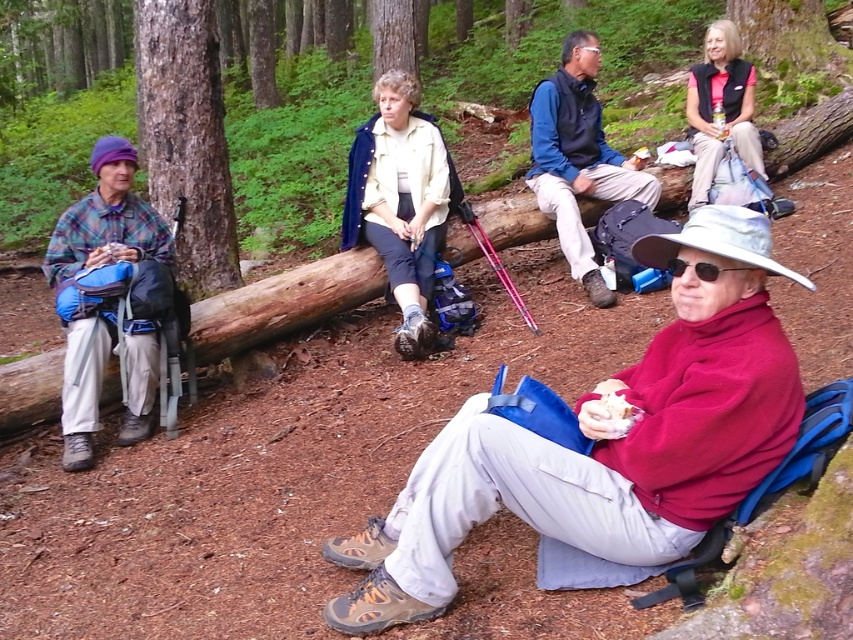
You are standing at the starting point and need to reach the black plastic sunglasses at lower center. There is a blue fabric backpack at center in your path. Can you walk around it without getting too close? Explain your reasoning.

The blue fabric backpack at center is 9.44 feet away from the black plastic sunglasses at lower center. Since the backpack is in your path, you can walk around it as there is enough space between them to maneuver around without getting too close.

You are a photographer trying to capture a photo of the plaid fabric shirt at left and the matte black vest at upper right. Which object should you focus on first if you want to ensure both are in the frame without moving the camera?

You should focus on the plaid fabric shirt at left first because it is taller than the matte black vest at upper right, so it will take up more space in the frame, ensuring both are captured without needing to adjust the camera position.